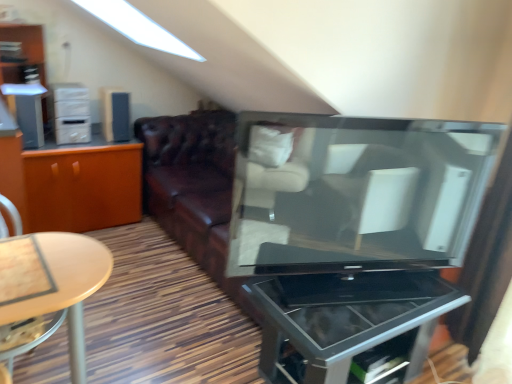
Question: Is point (40, 92) positioned closer to the camera than point (53, 104)?

Choices:
 (A) farther
 (B) closer

Answer: (B)

Question: From their relative heights in the image, would you say satin silver speaker at left, positioned as the 2th appliance in back-to-front order, is taller or shorter than white plastic cabinet at left?

Choices:
 (A) tall
 (B) short

Answer: (B)

Question: Which object is positioned farthest from the orange wood cabinet at left?

Choices:
 (A) satin silver speaker at left, which is counted as the 1th appliance, starting from the left
 (B) matte white dresser at upper left
 (C) matte black television at center
 (D) metallic glass tv stand at center
 (E) satin black speaker at upper left, the first appliance from the right

Answer: (D)

Question: Based on their relative distances, which object is farther from the white plastic cabinet at left?

Choices:
 (A) orange wood cabinet at left
 (B) matte black television at center
 (C) satin black speaker at upper left, the first appliance from the right
 (D) satin silver speaker at left, which is the 1th appliance in front-to-back order
 (E) matte white dresser at upper left

Answer: (B)